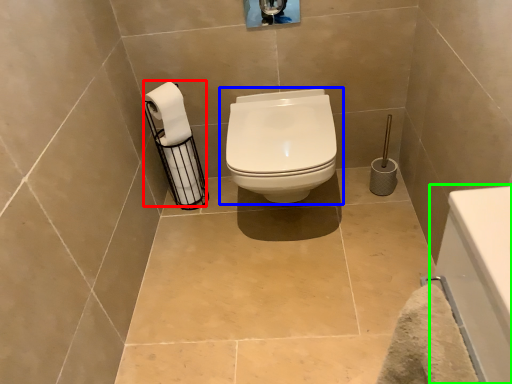
Question: Estimate the real-world distances between objects in this image. Which object is farther from toilet paper (highlighted by a red box), toilet (highlighted by a blue box) or bath (highlighted by a green box)?

Choices:
 (A) toilet
 (B) bath

Answer: (B)